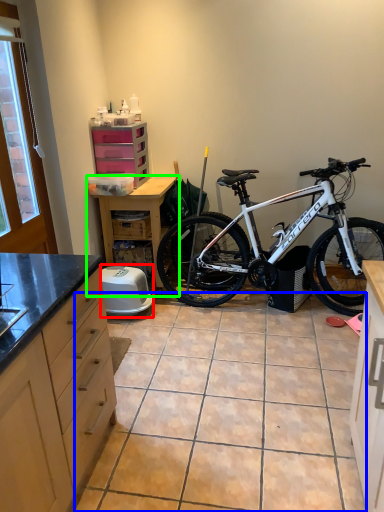
Question: Which object is positioned farthest from appliance (highlighted by a red box)? Select from tile (highlighted by a blue box) and table (highlighted by a green box).

Choices:
 (A) tile
 (B) table

Answer: (A)